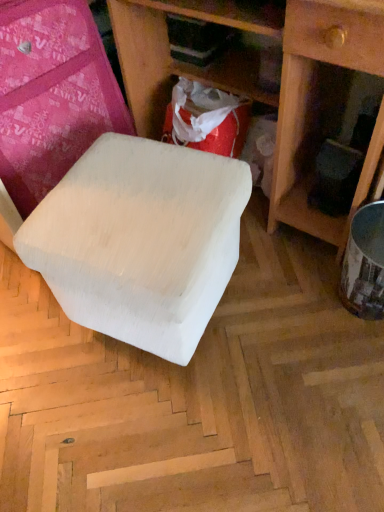
Question: From a real-world perspective, is white matte stool at center physically located above or below matte white stool at center?

Choices:
 (A) below
 (B) above

Answer: (A)

Question: Is white matte stool at center situated inside matte white stool at center or outside?

Choices:
 (A) outside
 (B) inside

Answer: (A)

Question: Is point (165, 224) positioned closer to the camera than point (344, 47)?

Choices:
 (A) farther
 (B) closer

Answer: (A)

Question: Choose the correct answer: Is matte white stool at center inside white matte stool at center or outside it?

Choices:
 (A) outside
 (B) inside

Answer: (A)

Question: In the image, is matte white stool at center positioned in front of or behind white matte stool at center?

Choices:
 (A) behind
 (B) front

Answer: (B)

Question: In terms of size, does matte white stool at center appear bigger or smaller than white matte stool at center?

Choices:
 (A) small
 (B) big

Answer: (B)

Question: Visually, is matte white stool at center positioned to the left or to the right of white matte stool at center?

Choices:
 (A) left
 (B) right

Answer: (B)